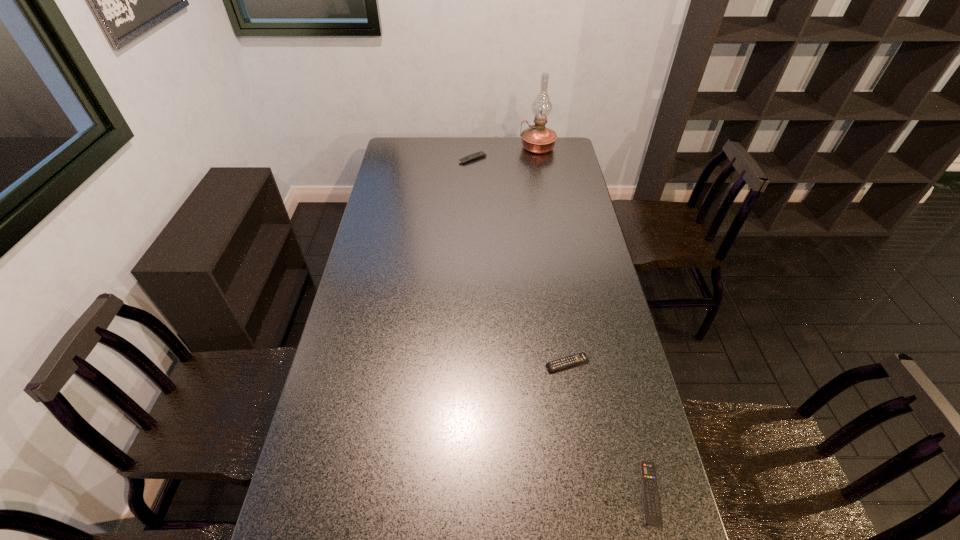
Identify which remote control is the third closest to the oil lamp. Please provide its 2D coordinates. Your answer should be formatted as a tuple, i.e. [(x, y)], where the tuple contains the x and y coordinates of a point satisfying the conditions above.

[(653, 514)]

You are a GUI agent. You are given a task and a screenshot of the screen. Output one action in this format:
    pyautogui.click(x=<x>, y=<y>)
    Task: Click on the remote control that stands as the second closest to the farthest remote control
    The width and height of the screenshot is (960, 540).
    Given the screenshot: What is the action you would take?
    pyautogui.click(x=653, y=514)

At what (x,y) coordinates should I click in order to perform the action: click on blank space that satisfies the following two spatial constraints: 1. on the back side of the oil lamp; 2. on the left side of the tallest remote control. Please return your answer as a coordinate pair (x, y). The image size is (960, 540). Looking at the image, I should click on (473, 147).

The height and width of the screenshot is (540, 960). I want to click on vacant area that satisfies the following two spatial constraints: 1. on the front side of the nearest object; 2. on the left side of the tallest object, so click(598, 494).

This screenshot has width=960, height=540. Find the location of `vacant region that satisfies the following two spatial constraints: 1. on the front side of the tallest remote control; 2. on the right side of the nearest object`. vacant region that satisfies the following two spatial constraints: 1. on the front side of the tallest remote control; 2. on the right side of the nearest object is located at coordinates (466, 494).